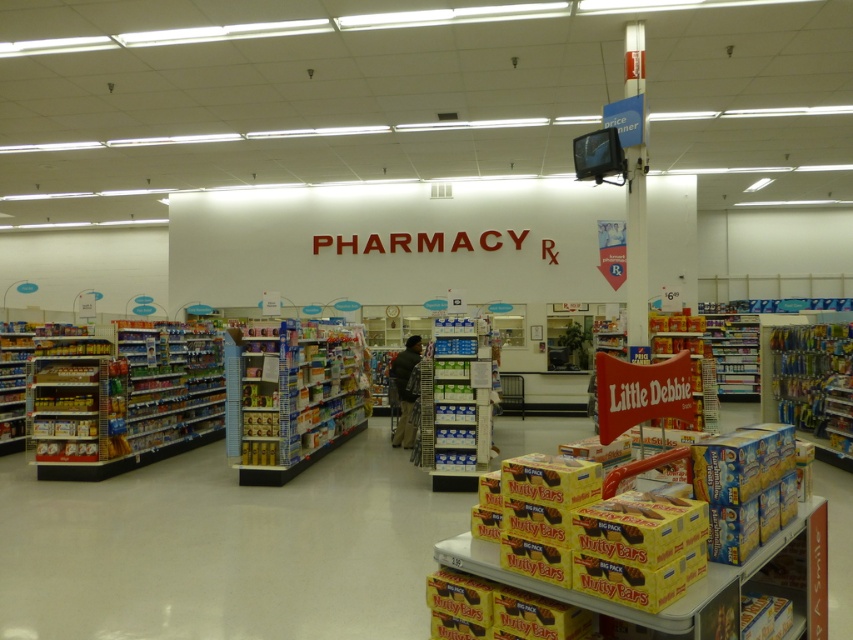
Does blue plastic shelf at center come behind dark green fabric jacket at center?

That is False.

Does blue plastic shelf at center have a greater width compared to dark green fabric jacket at center?

Yes.

This screenshot has height=640, width=853. I want to click on blue plastic shelf at center, so click(x=299, y=397).

Can you confirm if blue plastic shelf at center is thinner than white cardboard shelf at center?

Incorrect, blue plastic shelf at center's width is not less than white cardboard shelf at center's.

Measure the distance between point (x=310, y=368) and camera.

Point (x=310, y=368) is 9.54 meters away from camera.

This screenshot has height=640, width=853. Find the location of `blue plastic shelf at center`. blue plastic shelf at center is located at coordinates (299, 397).

Which is more to the right, white cardboard shelf at center or dark green fabric jacket at center?

white cardboard shelf at center is more to the right.

Who is lower down, white cardboard shelf at center or dark green fabric jacket at center?

dark green fabric jacket at center

Is point (440, 417) positioned before point (402, 413)?

Yes, point (440, 417) is closer to viewer.

Identify the location of white cardboard shelf at center. (456, 403).